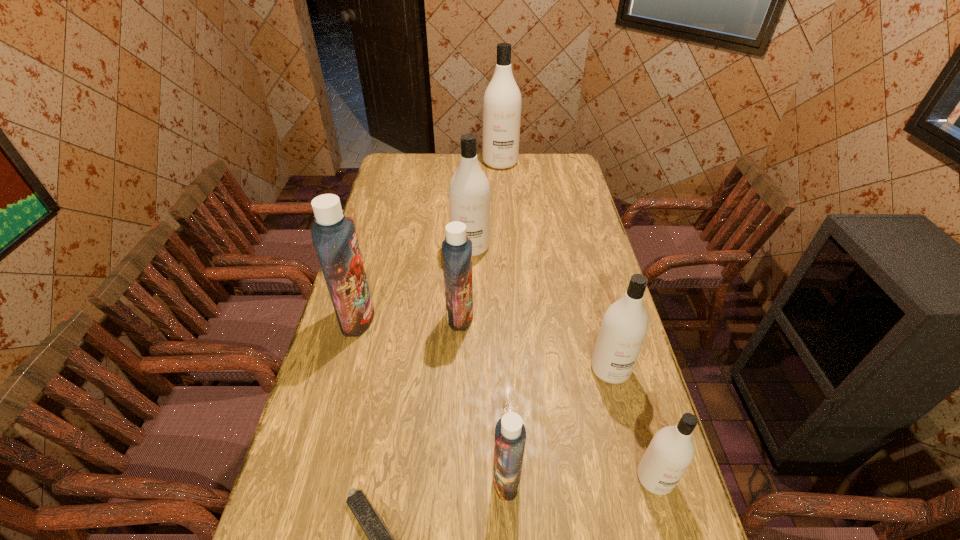
Where is `vacant space situated 0.080m on the front-facing side of the nearest white shampoo`? vacant space situated 0.080m on the front-facing side of the nearest white shampoo is located at coordinates (671, 535).

The height and width of the screenshot is (540, 960). I want to click on object that is positioned at the far edge, so click(x=502, y=101).

Locate an element on the screen. The image size is (960, 540). object located at the left edge is located at coordinates (334, 236).

In the image, there is a desktop. Identify the location of free region at the far edge. (442, 175).

Where is `free space at the left edge of the desktop`? free space at the left edge of the desktop is located at coordinates (373, 347).

You are a GUI agent. You are given a task and a screenshot of the screen. Output one action in this format:
    pyautogui.click(x=<x>, y=<y>)
    Task: Click on the vacant space at the right edge
    The image size is (960, 540).
    Given the screenshot: What is the action you would take?
    pyautogui.click(x=642, y=497)

You are a GUI agent. You are given a task and a screenshot of the screen. Output one action in this format:
    pyautogui.click(x=<x>, y=<y>)
    Task: Click on the free space between the leftmost shampoo and the smallest white shampoo
    The height and width of the screenshot is (540, 960).
    Given the screenshot: What is the action you would take?
    pyautogui.click(x=506, y=398)

The width and height of the screenshot is (960, 540). What are the coordinates of `free point between the nearest white shampoo and the second biggest blue shampoo` in the screenshot? It's located at (558, 397).

I want to click on vacant point located between the second smallest white shampoo and the second blue shampoo from right to left, so click(x=536, y=342).

The width and height of the screenshot is (960, 540). Identify the location of empty space that is in between the leftmost blue shampoo and the farthest white shampoo. (429, 240).